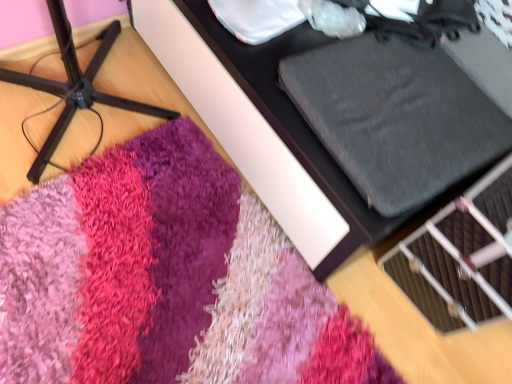
Question: Considering the relative positions of textured gray cushion at upper right, the 2th furniture positioned from the left, and shaggy pink rug at lower center in the image provided, is textured gray cushion at upper right, the 2th furniture positioned from the left, to the right of shaggy pink rug at lower center from the viewer's perspective?

Choices:
 (A) no
 (B) yes

Answer: (B)

Question: Could you tell me if textured gray cushion at upper right, arranged as the 1th furniture when viewed from the right, is facing shaggy pink rug at lower center?

Choices:
 (A) yes
 (B) no

Answer: (B)

Question: Is shaggy pink rug at lower center inside textured gray cushion at upper right, arranged as the 1th furniture when viewed from the right?

Choices:
 (A) no
 (B) yes

Answer: (B)

Question: From the image's perspective, is textured gray cushion at upper right, arranged as the 1th furniture when viewed from the right, over shaggy pink rug at lower center?

Choices:
 (A) no
 (B) yes

Answer: (B)

Question: Is textured gray cushion at upper right, arranged as the 1th furniture when viewed from the right, outside shaggy pink rug at lower center?

Choices:
 (A) no
 (B) yes

Answer: (B)

Question: Looking at the image, does shaggy carpet at lower left, the 1th furniture positioned from the left, seem bigger or smaller compared to shaggy pink rug at lower center?

Choices:
 (A) big
 (B) small

Answer: (A)

Question: From a real-world perspective, is shaggy carpet at lower left, the 1th furniture positioned from the left, physically located above or below shaggy pink rug at lower center?

Choices:
 (A) below
 (B) above

Answer: (B)

Question: From their relative heights in the image, would you say shaggy carpet at lower left, arranged as the second furniture when viewed from the right, is taller or shorter than shaggy pink rug at lower center?

Choices:
 (A) tall
 (B) short

Answer: (A)

Question: Choose the correct answer: Is shaggy carpet at lower left, arranged as the second furniture when viewed from the right, inside shaggy pink rug at lower center or outside it?

Choices:
 (A) outside
 (B) inside

Answer: (A)

Question: From a real-world perspective, is shaggy pink rug at lower center above or below textured gray cushion at upper right, the 2th furniture positioned from the left?

Choices:
 (A) below
 (B) above

Answer: (A)

Question: From their relative heights in the image, would you say shaggy pink rug at lower center is taller or shorter than textured gray cushion at upper right, arranged as the 1th furniture when viewed from the right?

Choices:
 (A) tall
 (B) short

Answer: (B)

Question: From the image's perspective, is shaggy pink rug at lower center positioned above or below textured gray cushion at upper right, the 2th furniture positioned from the left?

Choices:
 (A) below
 (B) above

Answer: (A)

Question: Is point (168, 183) positioned closer to the camera than point (287, 150)?

Choices:
 (A) closer
 (B) farther

Answer: (B)

Question: Visually, is shaggy carpet at lower left, the 1th furniture positioned from the left, positioned to the left or to the right of textured gray cushion at upper right, arranged as the 1th furniture when viewed from the right?

Choices:
 (A) right
 (B) left

Answer: (B)

Question: From the image's perspective, is shaggy carpet at lower left, the 1th furniture positioned from the left, above or below textured gray cushion at upper right, arranged as the 1th furniture when viewed from the right?

Choices:
 (A) below
 (B) above

Answer: (A)